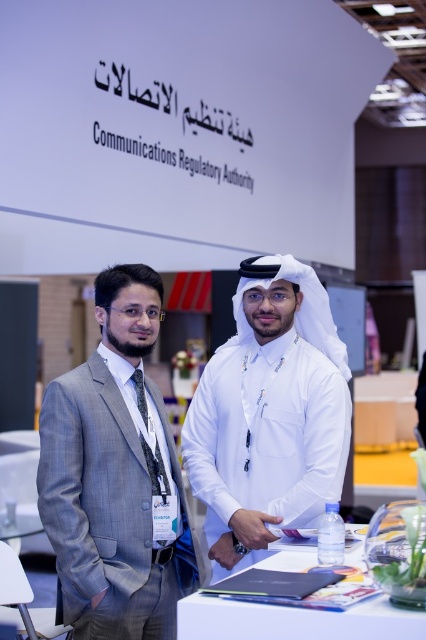
You are at an event and need to find the Communications Regulatory Authority booth. You see a person in a gray suit at left and another in traditional Middle Eastern attire. According to the coordinates provided, which object is located at point (x=115, y=476)?

The gray suit at left is located at point (x=115, y=476).

You are at the Communications Regulatory Authority event. You see a gray suit at left and a white matte shirt at center. Which one is closer to you?

The gray suit at left is closer to you because it is in front of the white matte shirt at center.